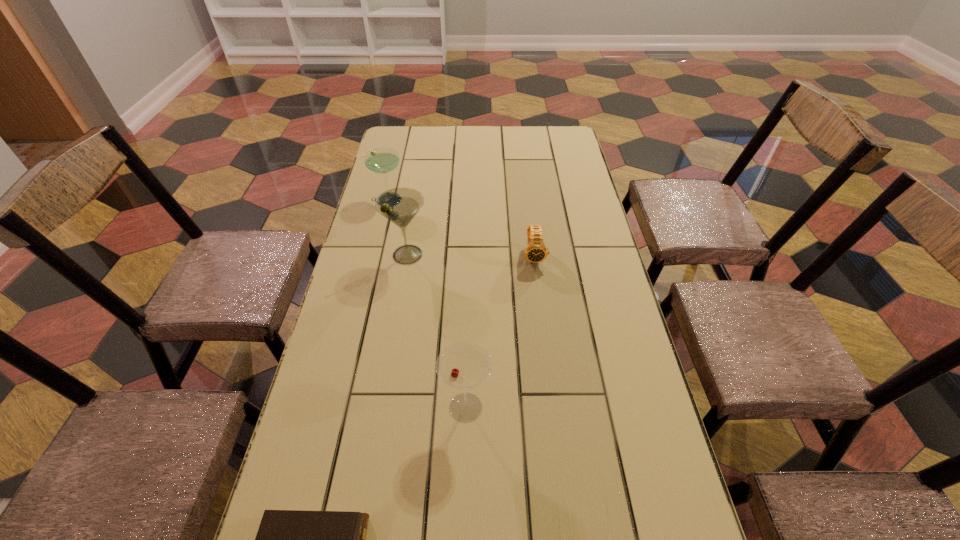
Locate an element on the screen. the tallest object is located at coordinates click(x=399, y=205).

Where is `the second nearest martini`? Image resolution: width=960 pixels, height=540 pixels. the second nearest martini is located at coordinates (399, 205).

Identify the location of the farthest martini. This screenshot has height=540, width=960. (382, 160).

Locate an element on the screen. This screenshot has height=540, width=960. the rightmost martini is located at coordinates (464, 365).

Image resolution: width=960 pixels, height=540 pixels. Identify the location of the nearest martini. (464, 365).

Image resolution: width=960 pixels, height=540 pixels. Identify the location of watch. (536, 251).

At what (x,y) coordinates should I click in order to perform the action: click on the rightmost object. Please return your answer as a coordinate pair (x, y). This screenshot has width=960, height=540. Looking at the image, I should click on (536, 251).

Where is `blank area located on the left of the second farthest martini`? blank area located on the left of the second farthest martini is located at coordinates click(x=355, y=255).

The width and height of the screenshot is (960, 540). Identify the location of vacant region located on the front of the farthest martini. (378, 237).

At what (x,y) coordinates should I click in order to perform the action: click on blank space located on the left of the fourth farthest object. Please return your answer as a coordinate pair (x, y). The width and height of the screenshot is (960, 540). Looking at the image, I should click on (410, 407).